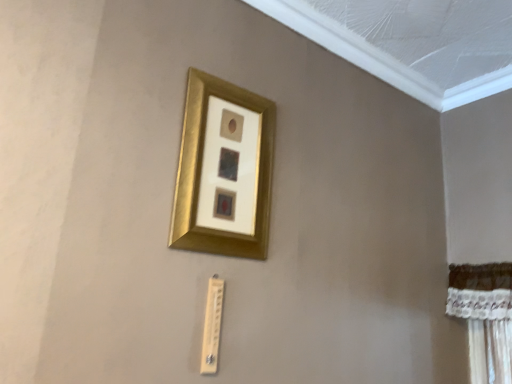
Question: Should I look upward or downward to see wooden thermometer at lower center?

Choices:
 (A) up
 (B) down

Answer: (B)

Question: Does wooden thermometer at lower center lie in front of gold metallic picture frame at upper center?

Choices:
 (A) yes
 (B) no

Answer: (B)

Question: Is wooden thermometer at lower center facing away from gold metallic picture frame at upper center?

Choices:
 (A) yes
 (B) no

Answer: (B)

Question: Is wooden thermometer at lower center thinner than gold metallic picture frame at upper center?

Choices:
 (A) yes
 (B) no

Answer: (A)

Question: From the image's perspective, is wooden thermometer at lower center located beneath gold metallic picture frame at upper center?

Choices:
 (A) yes
 (B) no

Answer: (A)

Question: From the image's perspective, does wooden thermometer at lower center appear higher than gold metallic picture frame at upper center?

Choices:
 (A) yes
 (B) no

Answer: (B)

Question: Is wooden thermometer at lower center to the right of gold metallic picture frame at upper center from the viewer's perspective?

Choices:
 (A) no
 (B) yes

Answer: (A)

Question: Considering the relative sizes of gold metallic picture frame at upper center and wooden thermometer at lower center in the image provided, is gold metallic picture frame at upper center taller than wooden thermometer at lower center?

Choices:
 (A) yes
 (B) no

Answer: (A)

Question: Considering the relative sizes of gold metallic picture frame at upper center and wooden thermometer at lower center in the image provided, is gold metallic picture frame at upper center shorter than wooden thermometer at lower center?

Choices:
 (A) no
 (B) yes

Answer: (A)

Question: Is the surface of gold metallic picture frame at upper center in direct contact with wooden thermometer at lower center?

Choices:
 (A) no
 (B) yes

Answer: (A)

Question: Does gold metallic picture frame at upper center have a smaller size compared to wooden thermometer at lower center?

Choices:
 (A) no
 (B) yes

Answer: (A)

Question: Is the depth of gold metallic picture frame at upper center greater than that of wooden thermometer at lower center?

Choices:
 (A) yes
 (B) no

Answer: (B)

Question: From the image's perspective, would you say gold metallic picture frame at upper center is shown under wooden thermometer at lower center?

Choices:
 (A) no
 (B) yes

Answer: (A)

Question: From their relative heights in the image, would you say wooden thermometer at lower center is taller or shorter than gold metallic picture frame at upper center?

Choices:
 (A) short
 (B) tall

Answer: (A)